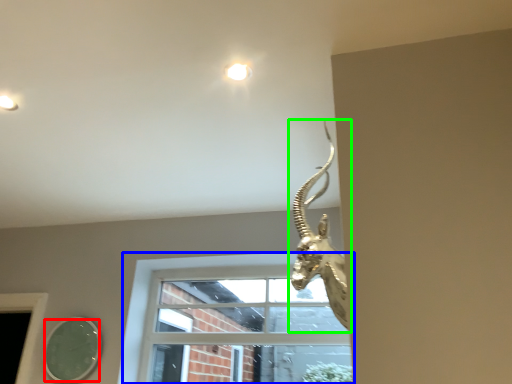
Question: Estimate the real-world distances between objects in this image. Which object is closer to mirror (highlighted by a red box), window (highlighted by a blue box) or animal (highlighted by a green box)?

Choices:
 (A) window
 (B) animal

Answer: (A)